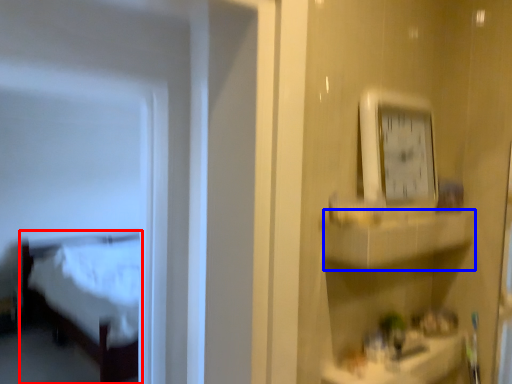
Question: Which point is closer to the camera, furniture (highlighted by a red box) or cabinet (highlighted by a blue box)?

Choices:
 (A) furniture
 (B) cabinet

Answer: (B)